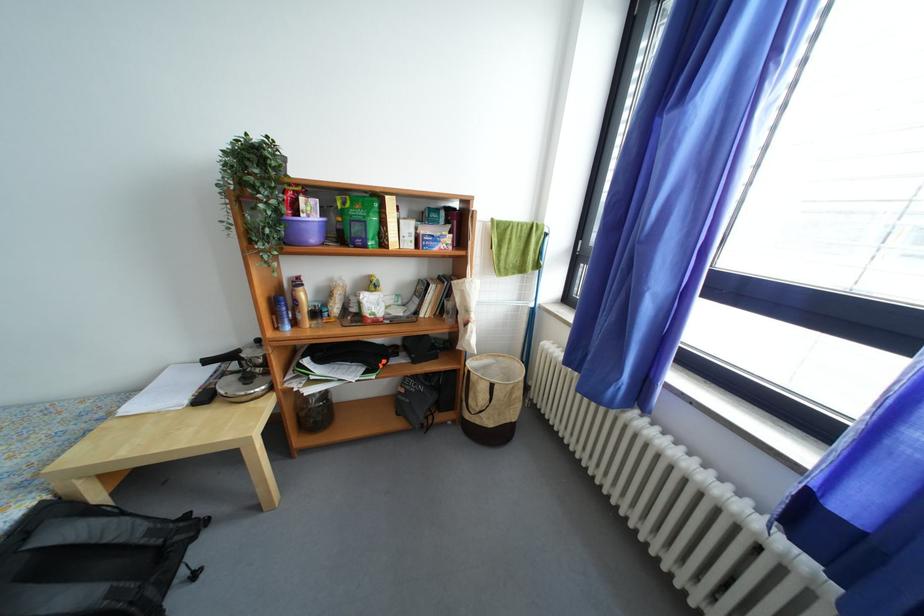
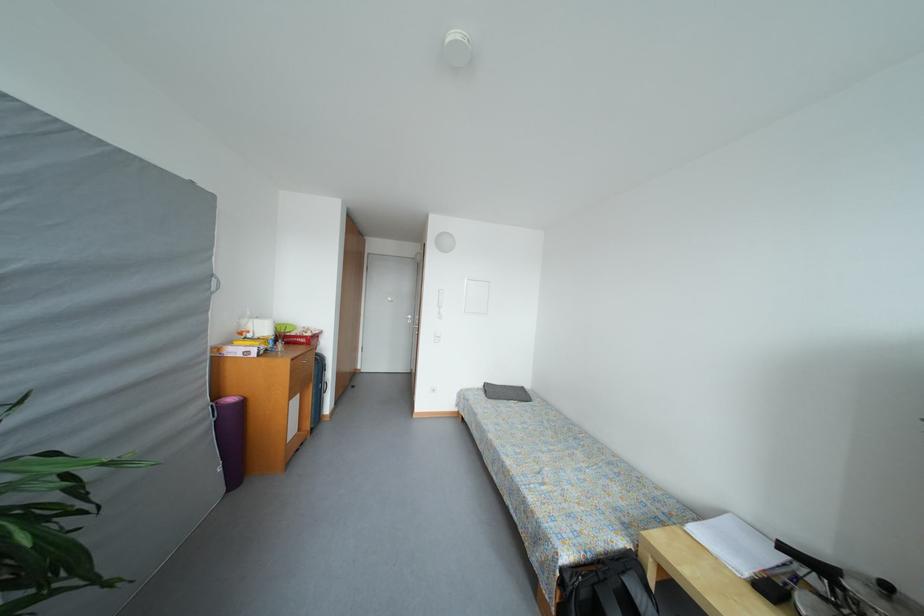
Find the pixel in the second image that matches (264,345) in the first image.

(893, 591)